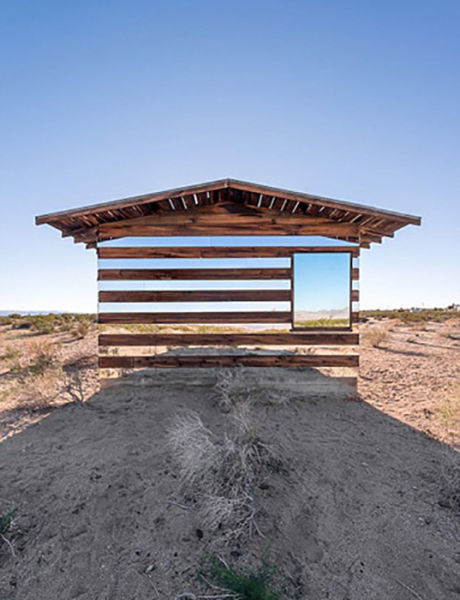
Find the location of a particular element. Image resolution: width=460 pixels, height=600 pixels. bottom slat is located at coordinates (206, 364).